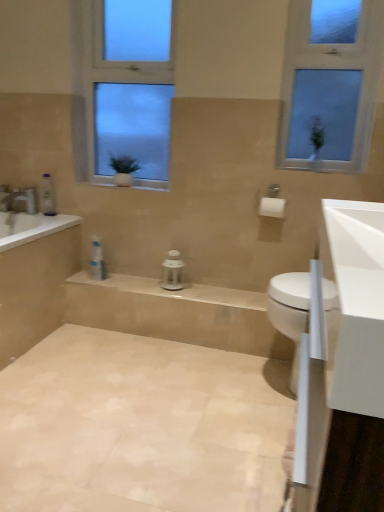
The image size is (384, 512). Describe the element at coordinates (34, 278) in the screenshot. I see `beige tile bath at lower left` at that location.

Looking at this image, in order to face clear plastic bottle at left, which is counted as the first toiletry, starting from the left, should I rotate leftwards or rightwards?

To face it directly, rotate left by 18.586 degrees.

In order to face beige tile floor at lower left, should I rotate leftwards or rightwards?

To face it directly, rotate left by 7.815 degrees.

This screenshot has width=384, height=512. In order to click on clear glass window at upper right, the 1th window positioned from the right in this screenshot , I will do (329, 83).

Does point (145, 188) come behind point (275, 216)?

Yes, point (145, 188) is behind point (275, 216).

Does white ceramic window sill at center have a larger size compared to white matte toilet paper at upper center?

Incorrect, white ceramic window sill at center is not larger than white matte toilet paper at upper center.

Is white ceramic window sill at center to the left or to the right of white matte toilet paper at upper center in the image?

Based on their positions, white ceramic window sill at center is located to the left of white matte toilet paper at upper center.

Is white matte toilet paper at upper center at the back of white ceramic window sill at center?

No.

Is white matte toilet paper at upper center to the right of white glossy bathtub at left from the viewer's perspective?

Yes.

Is white matte toilet paper at upper center oriented away from white glossy bathtub at left?

No, white glossy bathtub at left is not at the back of white matte toilet paper at upper center.

In the image, is white matte toilet paper at upper center positioned in front of or behind white glossy bathtub at left?

Visually, white matte toilet paper at upper center is located in front of white glossy bathtub at left.

Relative to white plastic toiletries at center, positioned as the second toiletry in left-to-right order, is beige tile bath at lower left in front or behind?

beige tile bath at lower left is in front of white plastic toiletries at center, positioned as the second toiletry in left-to-right order.

Which of these two, beige tile bath at lower left or white plastic toiletries at center, the first toiletry viewed from the right, is bigger?

beige tile bath at lower left is bigger.

Which is further, (x=54, y=290) or (x=96, y=278)?

Positioned behind is point (x=54, y=290).

Is beige tile bath at lower left far away from white plastic toiletries at center, positioned as the second toiletry in left-to-right order?

No.

Can you tell me how much white glossy sink at right and clear plastic bottle at left, which is counted as the first toiletry, starting from the left, differ in facing direction?

They differ by 90 degrees in their facing directions.

Consider the image. Would you say white glossy sink at right contains clear plastic bottle at left, placed as the 2th toiletry when sorted from right to left?

No, clear plastic bottle at left, placed as the 2th toiletry when sorted from right to left, is not a part of white glossy sink at right.

Based on the photo, is white glossy sink at right shorter than clear plastic bottle at left, placed as the 2th toiletry when sorted from right to left?

No, white glossy sink at right is not shorter than clear plastic bottle at left, placed as the 2th toiletry when sorted from right to left.

From a real-world perspective, is white glossy sink at right under clear plastic bottle at left, the second toiletry in the bottom-to-top sequence?

Indeed, from a real-world perspective, white glossy sink at right is positioned beneath clear plastic bottle at left, the second toiletry in the bottom-to-top sequence.

What's the angular difference between beige tile bath at lower left and beige tile floor at lower left's facing directions?

7.82e-06 degrees separate the facing orientations of beige tile bath at lower left and beige tile floor at lower left.

Considering the relative positions of beige tile bath at lower left and beige tile floor at lower left in the image provided, is beige tile bath at lower left to the left of beige tile floor at lower left from the viewer's perspective?

Indeed, beige tile bath at lower left is positioned on the left side of beige tile floor at lower left.

Between beige tile bath at lower left and beige tile floor at lower left, which one has larger size?

beige tile bath at lower left is bigger.

Is beige tile bath at lower left inside or outside of beige tile floor at lower left?

beige tile bath at lower left exists outside the volume of beige tile floor at lower left.

Does white ceramic window sill at center have a greater width compared to beige tile bath at lower left?

No, white ceramic window sill at center is not wider than beige tile bath at lower left.

Does white ceramic window sill at center touch beige tile bath at lower left?

No, white ceramic window sill at center is not making contact with beige tile bath at lower left.

Does white ceramic window sill at center have a smaller size compared to beige tile bath at lower left?

Indeed, white ceramic window sill at center has a smaller size compared to beige tile bath at lower left.

In the scene shown: Could beige tile bath at lower left be considered to be inside white ceramic window sill at center?

Definitely not — beige tile bath at lower left is not inside white ceramic window sill at center.

Is clear glass window at center, acting as the 1th window starting from the left, in contact with clear plastic bottle at left, placed as the 2th toiletry when sorted from right to left?

No, clear glass window at center, acting as the 1th window starting from the left, is not touching clear plastic bottle at left, placed as the 2th toiletry when sorted from right to left.

Is clear glass window at center, acting as the 1th window starting from the left, positioned with its back to clear plastic bottle at left, the first toiletry in the top-to-bottom sequence?

That's not correct — clear glass window at center, acting as the 1th window starting from the left, is not looking away from clear plastic bottle at left, the first toiletry in the top-to-bottom sequence.

Is clear glass window at center, acting as the 1th window starting from the left, to the left of clear plastic bottle at left, placed as the 2th toiletry when sorted from right to left, from the viewer's perspective?

No, clear glass window at center, acting as the 1th window starting from the left, is not to the left of clear plastic bottle at left, placed as the 2th toiletry when sorted from right to left.

Is clear glass window at center, the second window viewed from the right, surrounding clear plastic bottle at left, the first toiletry in the top-to-bottom sequence?

No, clear plastic bottle at left, the first toiletry in the top-to-bottom sequence, is not inside clear glass window at center, the second window viewed from the right.

This screenshot has width=384, height=512. I want to click on toilet paper below the white ceramic window sill at center (from a real-world perspective), so click(x=272, y=207).

The image size is (384, 512). Identify the location of toilet paper to the right of white glossy bathtub at left. (272, 207).

Based on their spatial positions, is white glossy sink at right or white matte toilet paper at upper center closer to white glossy bathtub at left?

white matte toilet paper at upper center is positioned closer to the anchor white glossy bathtub at left.

Considering their positions, is clear glass window at upper right, the 1th window positioned from the right, positioned further to beige tile floor at lower left than white plastic toiletries at center, the first toiletry viewed from the right?

clear glass window at upper right, the 1th window positioned from the right, is positioned further to the anchor beige tile floor at lower left.

From the picture: From the image, which object appears to be nearer to white glossy bathtub at left, clear plastic bottle at left, which is counted as the first toiletry, starting from the left, or white matte toilet paper at upper center?

clear plastic bottle at left, which is counted as the first toiletry, starting from the left, lies closer to white glossy bathtub at left than the other object.

From the image, which object appears to be farther from white glossy bathtub at left, white glossy sink at right or beige tile floor at lower left?

Among the two, white glossy sink at right is located further to white glossy bathtub at left.

Which object lies nearer to the anchor point beige tile bath at lower left, clear glass window at center, the second window viewed from the right, or white matte toilet paper at upper center?

The object closer to beige tile bath at lower left is clear glass window at center, the second window viewed from the right.

Which object lies nearer to the anchor point beige tile bath at lower left, clear plastic bottle at left, the second toiletry in the bottom-to-top sequence, or beige tile floor at lower left?

The object closer to beige tile bath at lower left is clear plastic bottle at left, the second toiletry in the bottom-to-top sequence.

Estimate the real-world distances between objects in this image. Which object is further from white plastic toiletries at center, positioned as the second toiletry in left-to-right order, beige tile bath at lower left or clear plastic bottle at left, placed as the 2th toiletry when sorted from right to left?

The object further to white plastic toiletries at center, positioned as the second toiletry in left-to-right order, is clear plastic bottle at left, placed as the 2th toiletry when sorted from right to left.

Considering their positions, is white plastic toiletries at center, positioned as the second toiletry in left-to-right order, positioned closer to white glossy bathtub at left than beige tile bath at lower left?

beige tile bath at lower left.

I want to click on toilet paper between white plastic toiletries at center, positioned as the second toiletry in left-to-right order, and white glossy sink at right, in the horizontal direction, so click(x=272, y=207).

Locate an element on the screen. The height and width of the screenshot is (512, 384). toiletry between beige tile bath at lower left and clear plastic bottle at left, the first toiletry in the top-to-bottom sequence, from front to back is located at coordinates (97, 260).

This screenshot has height=512, width=384. What are the coordinates of `sink located between beige tile bath at lower left and clear glass window at upper right, which is the second window from left to right, in the left-right direction` in the screenshot? It's located at (290, 311).

This screenshot has height=512, width=384. I want to click on bath situated between white glossy bathtub at left and white matte toilet paper at upper center from left to right, so click(x=34, y=278).